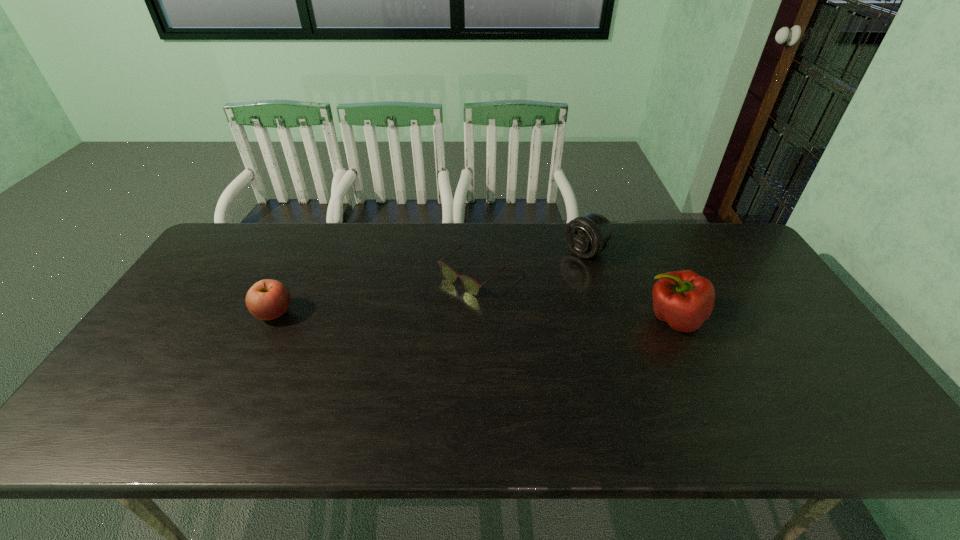
Locate an element on the screen. the second shortest object is located at coordinates (268, 299).

What are the coordinates of `the leftmost object` in the screenshot? It's located at (268, 299).

What are the coordinates of `bell pepper` in the screenshot? It's located at (683, 299).

Find the location of a particular element. the second object from right to left is located at coordinates (587, 235).

Where is `the shortest object`? the shortest object is located at coordinates (471, 286).

Find the location of a particular element. The width and height of the screenshot is (960, 540). spectacles is located at coordinates (471, 286).

The width and height of the screenshot is (960, 540). I want to click on free location located 0.050m on the back of the leftmost object, so click(287, 287).

At what (x,y) coordinates should I click in order to perform the action: click on vacant space located on the left of the bell pepper. Please return your answer as a coordinate pair (x, y). The image size is (960, 540). Looking at the image, I should click on (560, 319).

Locate an element on the screen. free space located on the front-facing side of the telephoto lens is located at coordinates (548, 276).

Locate an element on the screen. vacant space located on the front-facing side of the telephoto lens is located at coordinates (559, 269).